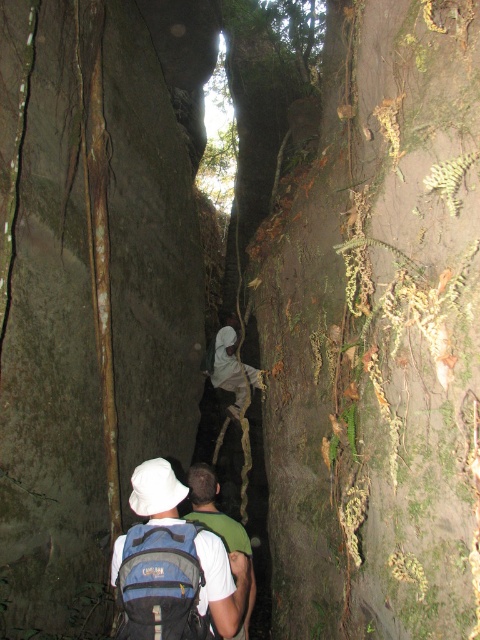
You are a hiker navigating a narrow rocky crevice. You notice two backpacks in front of you. The blue fabric backpack at center and the white matte backpack at center. Which backpack is positioned higher up in the crevice?

The blue fabric backpack at center is located above the white matte backpack at center, so it is positioned higher up in the crevice.

You are planning to navigate through the narrow crevice and need to know if the blue fabric backpack at center and the white matte backpack at center can fit side by side. Based on their widths, what is your assessment?

The blue fabric backpack at center is wider than the white matte backpack at center. Since the crevice is narrow, fitting both side by side may be challenging depending on the exact dimensions of the crevice and the backpacks.

You are standing at the entrance of the crevice and want to reach the point marked at coordinates point (228, 557). If your camera is 6 feet tall, will the point be within your line of sight?

The distance of point (228, 557) from camera is 11.51 feet. Since the camera is 6 feet tall, the point is within your line of sight as it is within the camera range.